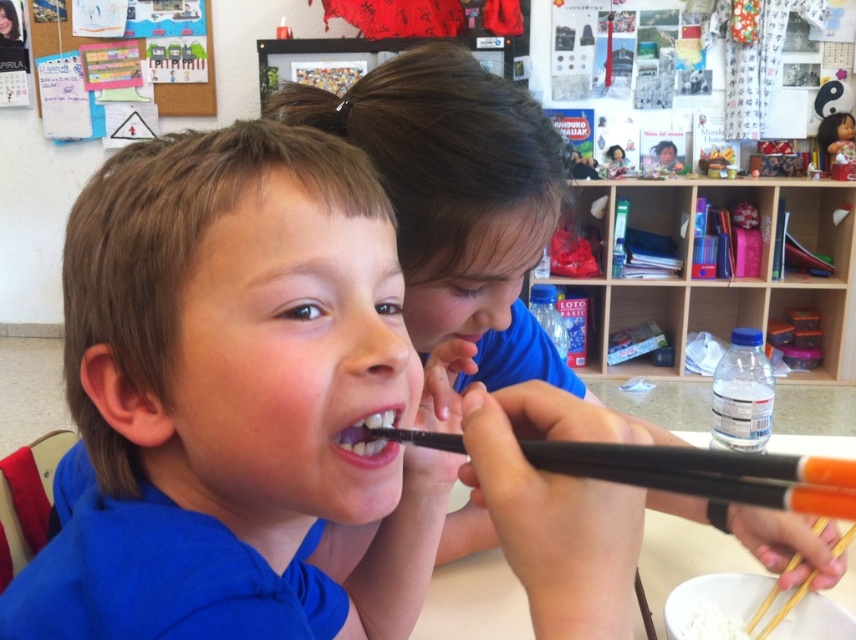
How much distance is there between white glossy teeth at center and wooden chopsticks at lower right?

white glossy teeth at center is 51.57 centimeters away from wooden chopsticks at lower right.

Does white glossy teeth at center have a lesser height compared to wooden chopsticks at lower right?

Yes.

Does point (395, 403) lie in front of point (788, 563)?

Yes, it is in front of point (788, 563).

Find the location of a particular element. white glossy teeth at center is located at coordinates (367, 436).

Between white matte rice at lower center and pink glossy lips at center, which one appears on the right side from the viewer's perspective?

white matte rice at lower center is more to the right.

Looking at this image, does white matte rice at lower center have a greater height compared to pink glossy lips at center?

No, white matte rice at lower center is not taller than pink glossy lips at center.

The image size is (856, 640). What do you see at coordinates (714, 625) in the screenshot?
I see `white matte rice at lower center` at bounding box center [714, 625].

Identify the location of white matte rice at lower center. Image resolution: width=856 pixels, height=640 pixels. (714, 625).

This screenshot has height=640, width=856. What do you see at coordinates (786, 605) in the screenshot?
I see `wooden chopsticks at lower right` at bounding box center [786, 605].

Is wooden chopsticks at lower right to the right of white matte rice at lower center from the viewer's perspective?

Yes, wooden chopsticks at lower right is to the right of white matte rice at lower center.

Identify the location of wooden chopsticks at lower right. This screenshot has width=856, height=640. (786, 605).